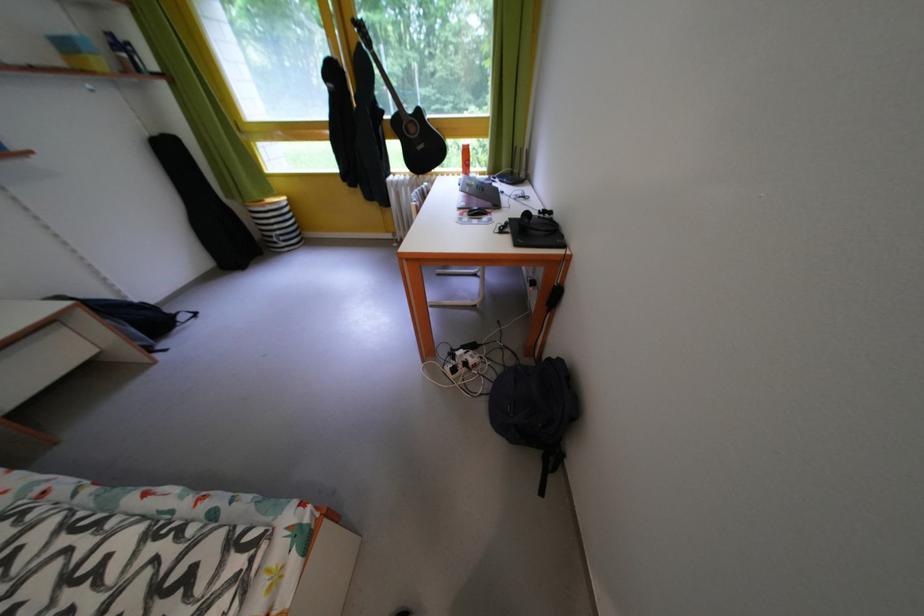
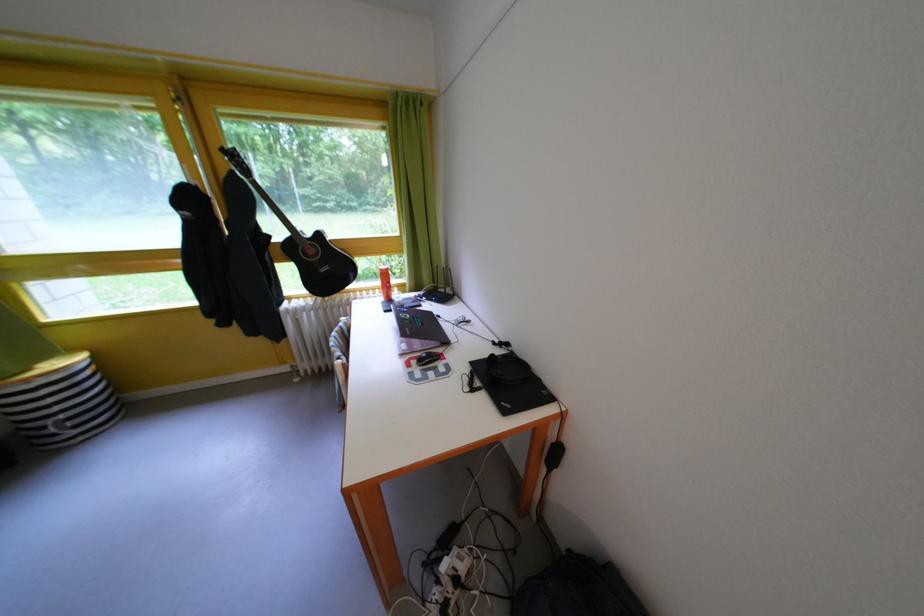
Which direction would the cameraman need to move to produce the second image?

The cameraman walked toward left, forward.